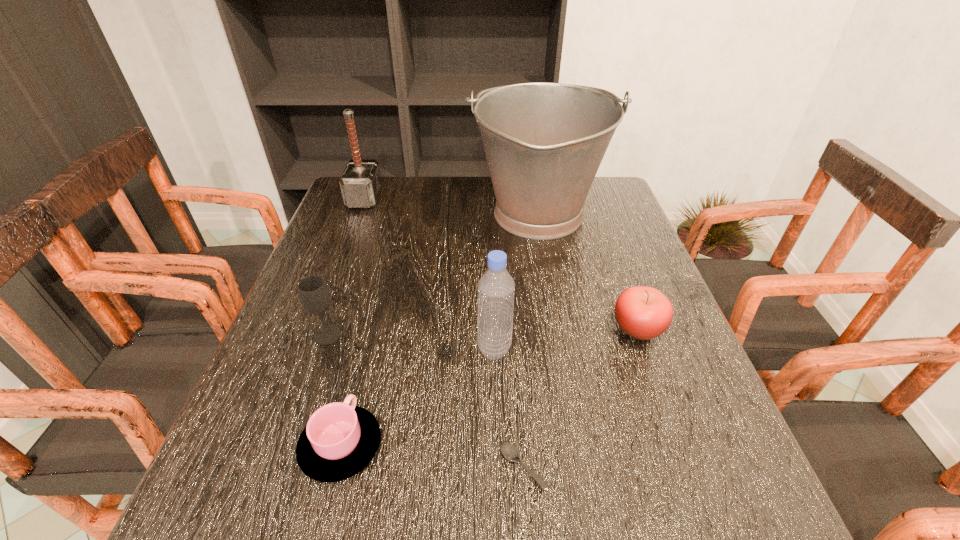
This screenshot has width=960, height=540. Find the location of `vacant space situated 0.300m on the front of the wineglass`. vacant space situated 0.300m on the front of the wineglass is located at coordinates (272, 496).

The image size is (960, 540). Identify the location of free spot located 0.390m on the left of the apple. (428, 328).

I want to click on free spot located on the side with the handle of the sixth tallest object, so click(372, 324).

This screenshot has height=540, width=960. I want to click on vacant point located on the side with the handle of the sixth tallest object, so click(x=384, y=275).

At what (x,y) coordinates should I click in order to perform the action: click on vacant point located on the side with the handle of the sixth tallest object. Please return your answer as a coordinate pair (x, y). Looking at the image, I should click on (366, 346).

In order to click on free region located on the back of the soupspoon in this screenshot , I will do `click(516, 384)`.

This screenshot has width=960, height=540. I want to click on bucket located in the far edge section of the desktop, so click(544, 142).

Where is `hammer positioned at the far edge`? This screenshot has width=960, height=540. hammer positioned at the far edge is located at coordinates (361, 183).

At what (x,y) coordinates should I click in order to perform the action: click on cup positioned at the near edge. Please return your answer as a coordinate pair (x, y). Looking at the image, I should click on (339, 440).

Where is `soupspoon located at the near edge`? Image resolution: width=960 pixels, height=540 pixels. soupspoon located at the near edge is located at coordinates (510, 451).